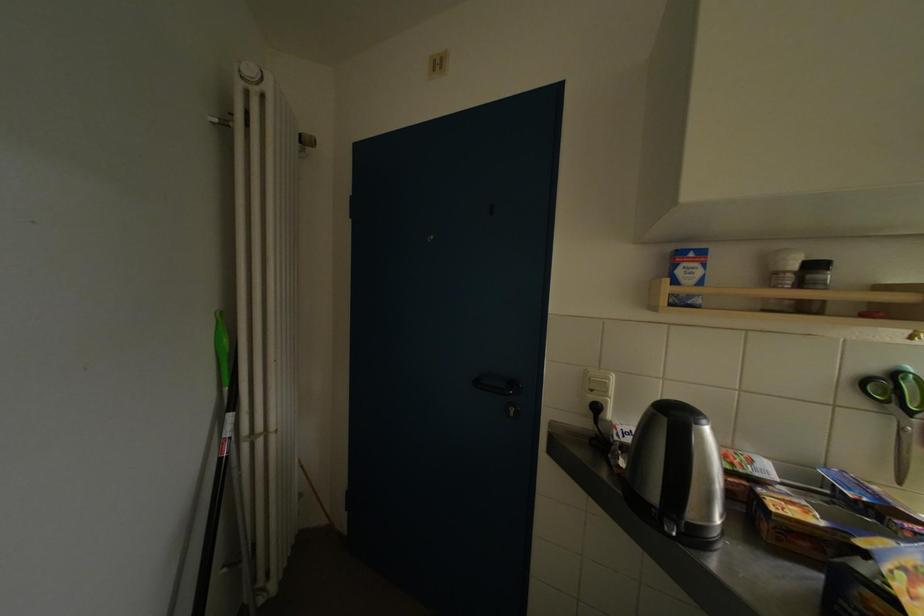
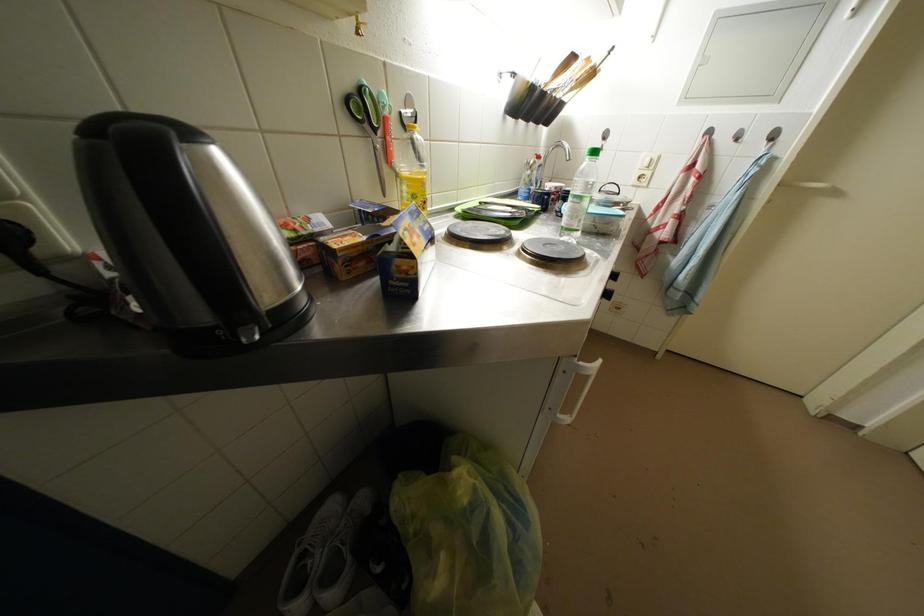
How did the camera likely rotate?

The rotation direction of the camera is right-down.